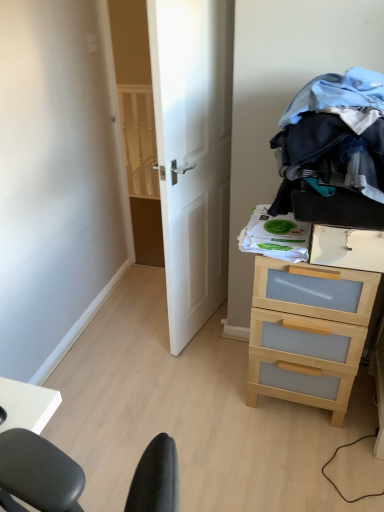
Where is `free space in front of light wood/ribbed drawer at right`? free space in front of light wood/ribbed drawer at right is located at coordinates (307, 461).